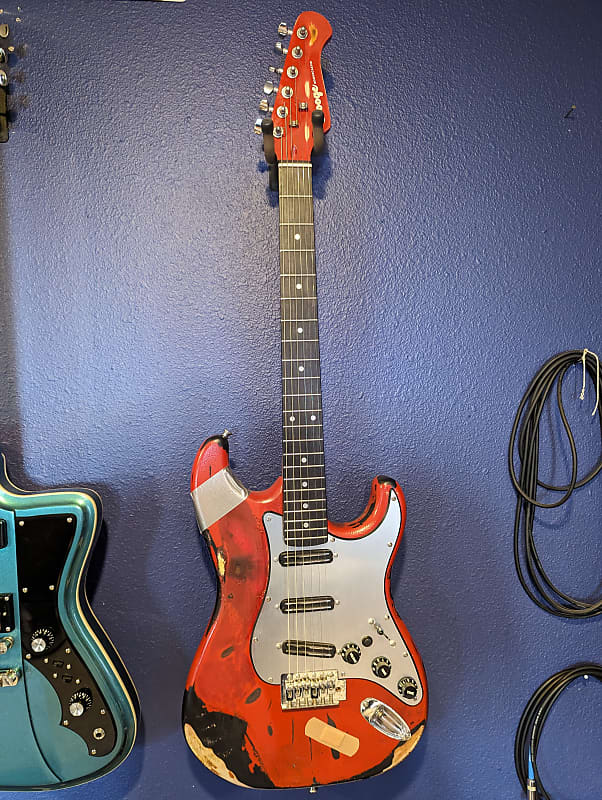
The height and width of the screenshot is (800, 602). What are the coordinates of `silver knob` in the screenshot? It's located at (38, 646).